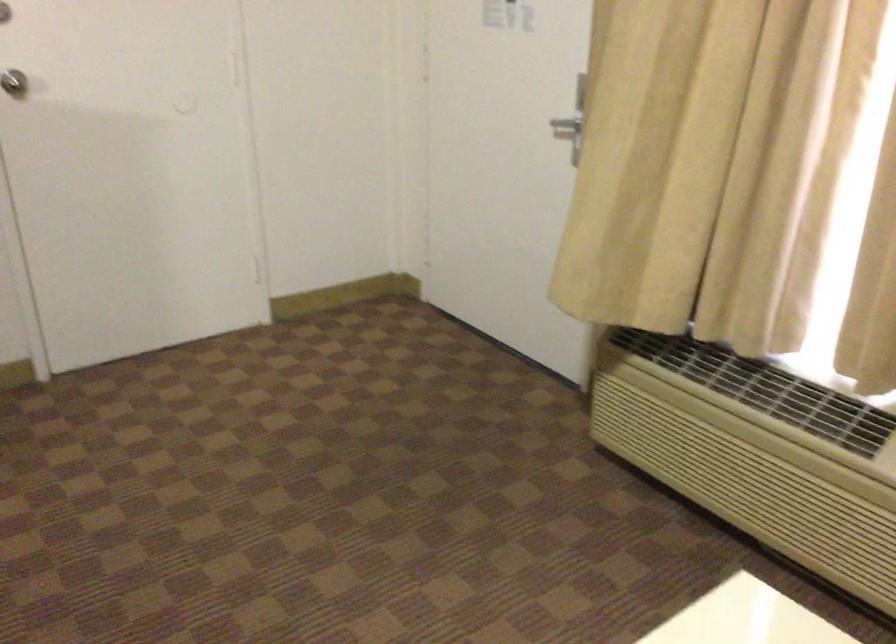
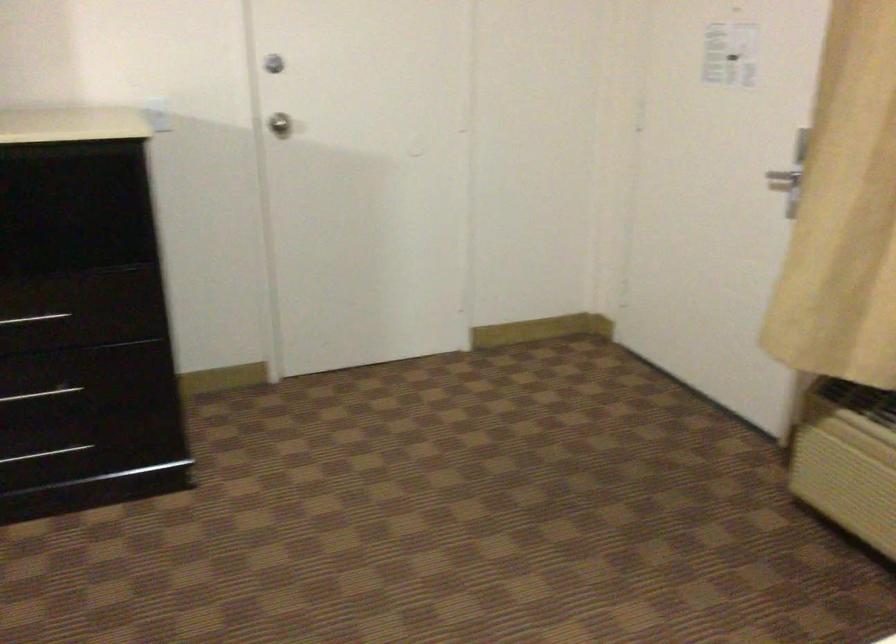
Question: The images are taken continuously from a first-person perspective. In which direction are you moving?

Choices:
 (A) Left
 (B) Right
 (C) Forward
 (D) Backward

Answer: (D)